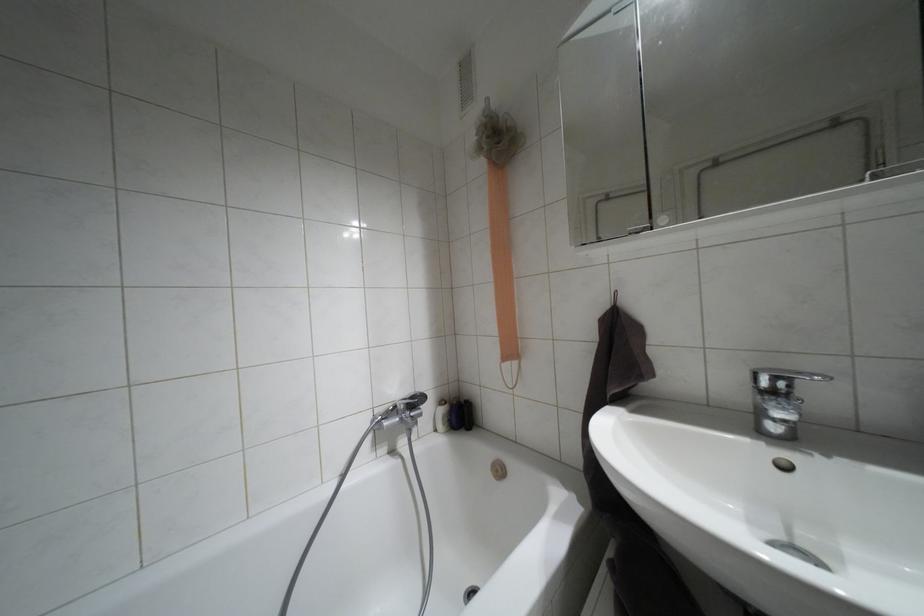
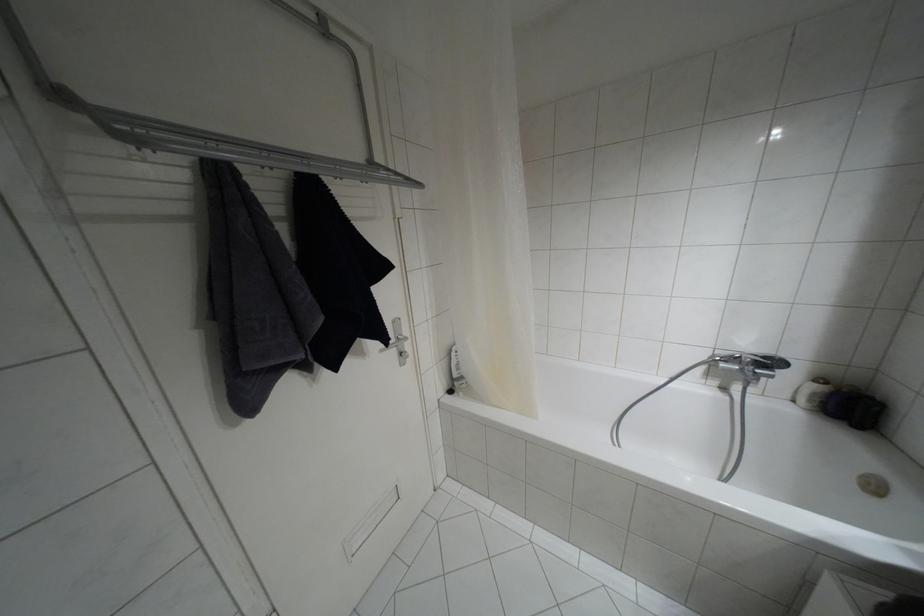
The point at (x=410, y=397) is marked in the first image. Where is the corresponding point in the second image?

(763, 357)